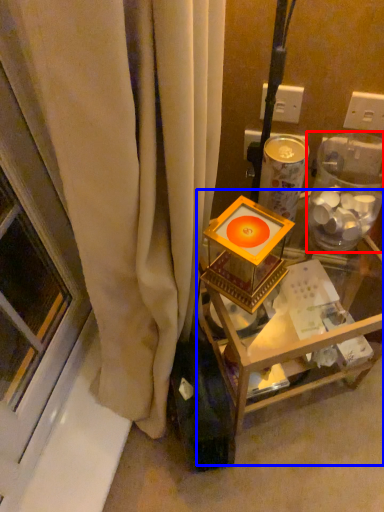
Question: Among these objects, which one is farthest to the camera, glass box (highlighted by a red box) or furniture (highlighted by a blue box)?

Choices:
 (A) glass box
 (B) furniture

Answer: (B)